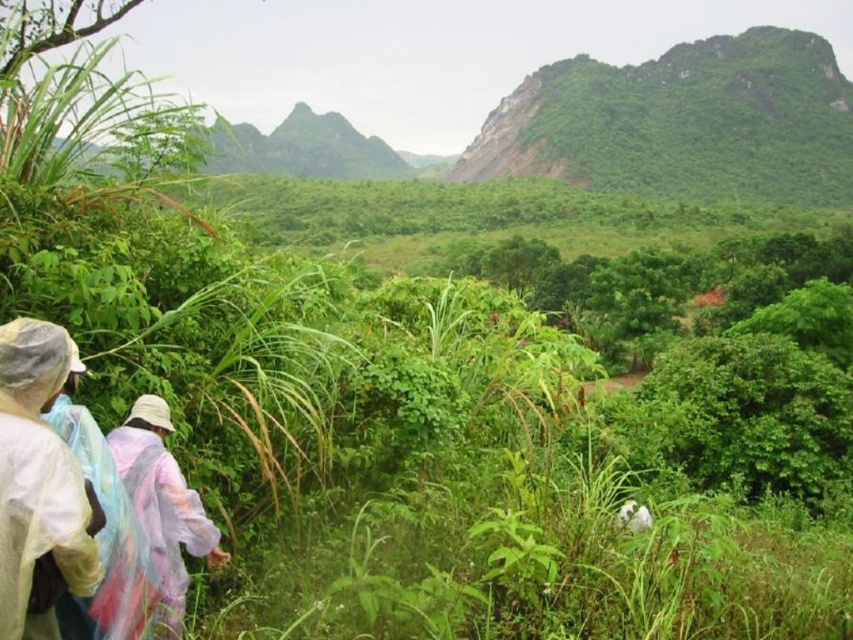
Which of these two, transparent plastic raincoat at lower left or raincoat fabric at lower left, stands taller?

transparent plastic raincoat at lower left is taller.

Who is positioned more to the right, transparent plastic raincoat at lower left or raincoat fabric at lower left?

Positioned to the right is raincoat fabric at lower left.

Between point (51, 474) and point (164, 577), which one is positioned in front?

Point (51, 474) is in front.

Locate an element on the screen. transparent plastic raincoat at lower left is located at coordinates (39, 483).

Locate an element on the screen. This screenshot has width=853, height=640. green leafy hillside at upper right is located at coordinates (683, 122).

Which is in front, point (653, 97) or point (192, 554)?

Point (192, 554) is in front.

Does green leafy hillside at upper right lie in front of raincoat fabric at lower left?

No, it is behind raincoat fabric at lower left.

Measure the distance between green leafy hillside at upper right and camera.

green leafy hillside at upper right is 745.90 feet away from camera.

The width and height of the screenshot is (853, 640). What are the coordinates of `green leafy hillside at upper right` in the screenshot? It's located at (683, 122).